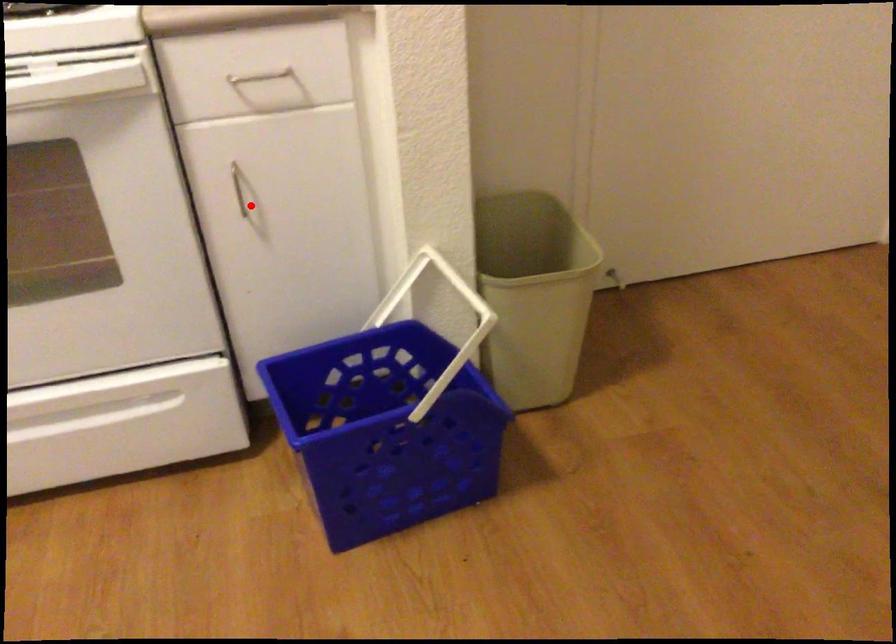
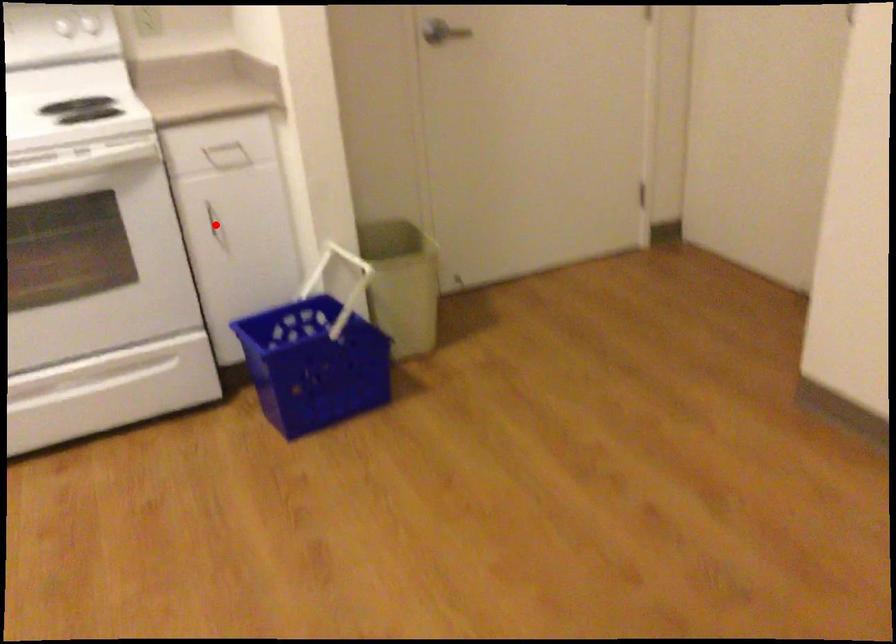
I am providing you with two images of the same scene from different viewpoints. A red point is marked on the first image and another point is marked on the second image. Is the red point in image1 aligned with the point shown in image2?

Yes